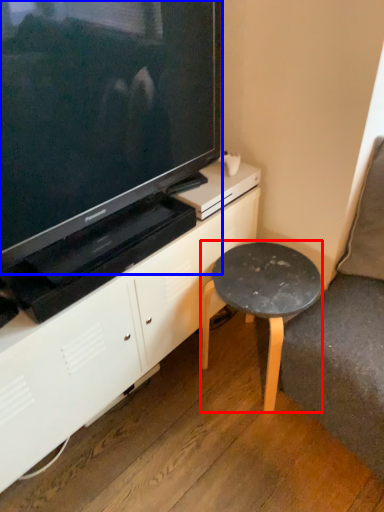
Question: Among these objects, which one is farthest to the camera, stool (highlighted by a red box) or television (highlighted by a blue box)?

Choices:
 (A) stool
 (B) television

Answer: (A)